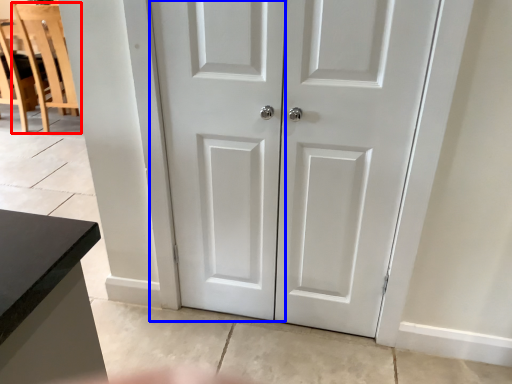
Question: Among these objects, which one is farthest to the camera, chair (highlighted by a red box) or screen door (highlighted by a blue box)?

Choices:
 (A) chair
 (B) screen door

Answer: (A)